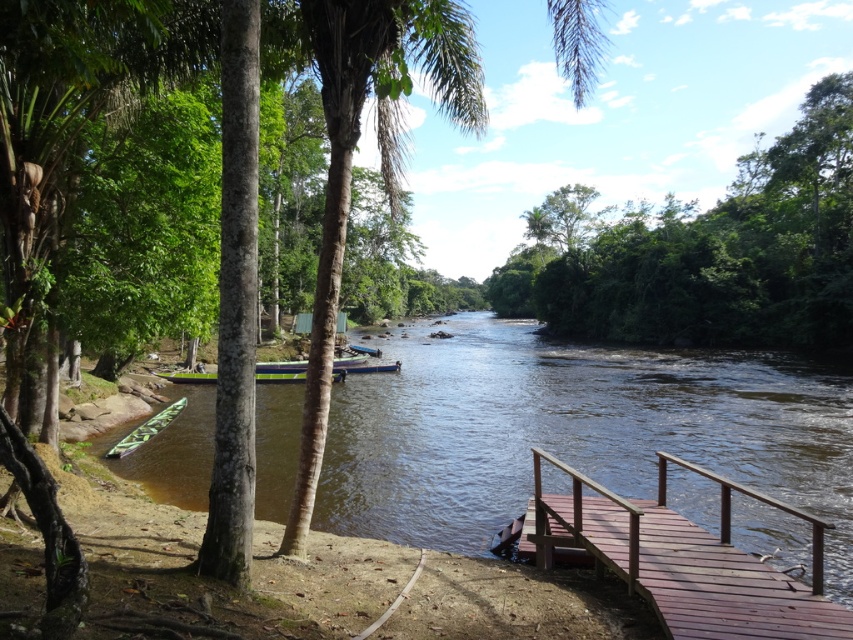
You are standing on the brown wooden dock at lower right and want to reach the green plastic boat at lower left. Which direction should you move to get there?

You should move to the left because the brown wooden dock at lower right is positioned on the right side of the green plastic boat at lower left, so moving left will take you towards it.

You are a park ranger planning to install a new pathway connecting the green leafy tree at upper center to the brown wooden dock at lower right. If the pathway must be exactly 50 meters long, will it be long enough to reach between them?

The distance between the green leafy tree at upper center and the brown wooden dock at lower right is 54.77 meters. Since the pathway is only 50 meters long, it will not be long enough to reach between them.

You are standing at the riverside and want to determine which of the two points, point (727, 529) or point (120, 448), is closer to you. Based on the scene, which point is nearer?

Point (727, 529) is closer to the viewer than point (120, 448).